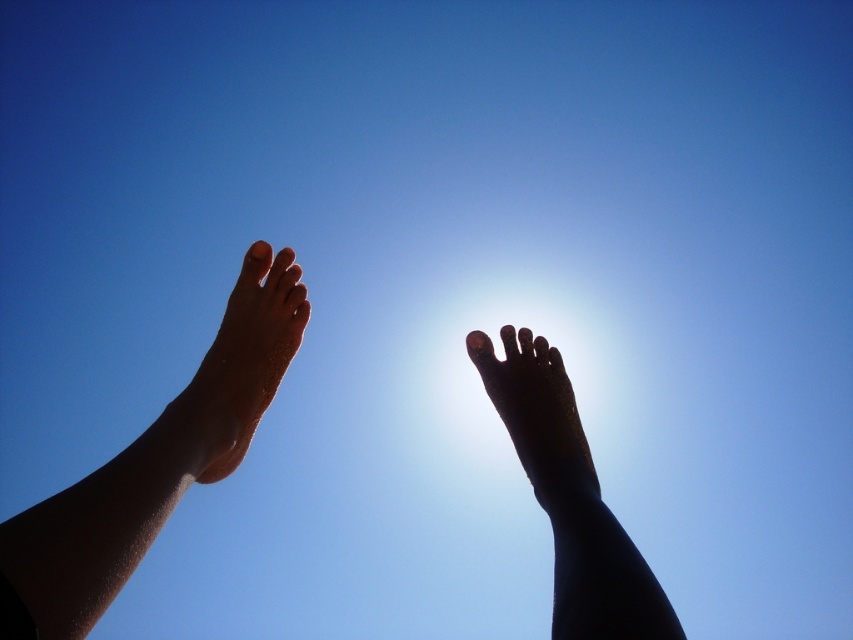
Who is lower down, sandy skin leg at left or sandy tan foot at upper left?

Positioned lower is sandy skin leg at left.

Does sandy skin leg at left have a greater width compared to sandy tan foot at upper left?

Incorrect, sandy skin leg at left's width does not surpass sandy tan foot at upper left's.

Does point (229, 385) come closer to viewer compared to point (287, 337)?

Yes, it is.

Where is `sandy skin leg at left`? The height and width of the screenshot is (640, 853). sandy skin leg at left is located at coordinates (158, 458).

Does sandy feet at center have a lesser width compared to black matte foot at center?

Indeed, sandy feet at center has a lesser width compared to black matte foot at center.

Find the location of `sandy feet at center`. sandy feet at center is located at coordinates (154, 465).

This screenshot has height=640, width=853. I want to click on sandy feet at center, so click(154, 465).

Is black matte foot at upper center further to the viewer compared to black matte foot at center?

That is False.

Which is more to the right, black matte foot at upper center or black matte foot at center?

Positioned to the right is black matte foot at center.

Who is more distant from viewer, (x=517, y=413) or (x=538, y=433)?

The point (x=517, y=413) is behind.

The image size is (853, 640). In order to click on black matte foot at upper center in this screenshot , I will do `click(570, 497)`.